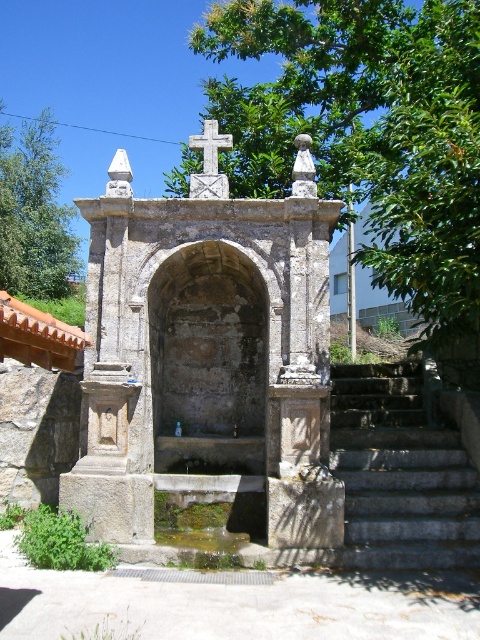
Question: Does stone fountain at center appear on the left side of white stone cross at center?

Choices:
 (A) no
 (B) yes

Answer: (A)

Question: Which object is closer to the camera taking this photo?

Choices:
 (A) stone fountain at center
 (B) gray stone stairs at lower right
 (C) white stone cross at center

Answer: (B)

Question: Which object appears farthest from the camera in this image?

Choices:
 (A) green leafy tree at upper center
 (B) gray stone stairs at lower right
 (C) green leafy tree at left
 (D) stone fountain at center

Answer: (C)

Question: Does green leafy tree at upper center have a smaller size compared to white stone cross at center?

Choices:
 (A) no
 (B) yes

Answer: (A)

Question: Can you confirm if stone fountain at center is bigger than green leafy tree at left?

Choices:
 (A) yes
 (B) no

Answer: (B)

Question: Which is farther from the stone fountain at center?

Choices:
 (A) gray stone stairs at lower right
 (B) green leafy tree at left

Answer: (B)